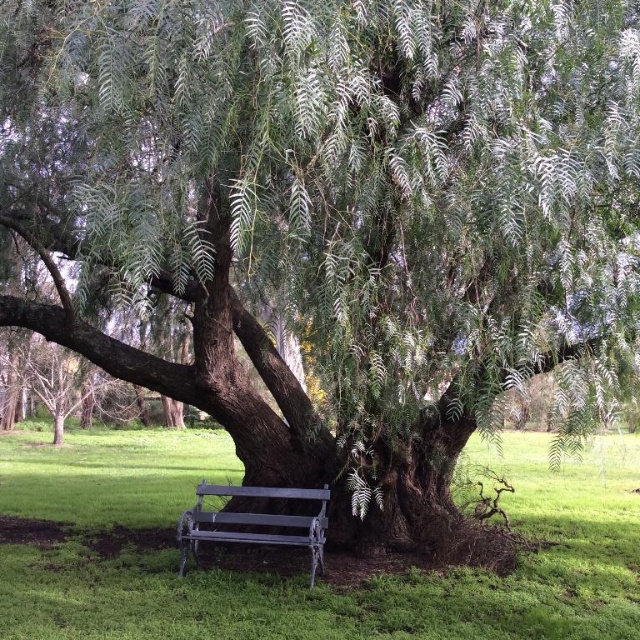
Who is more distant from viewer, (x=627, y=513) or (x=196, y=492)?

The point (x=627, y=513) is behind.

Is green grass at lower center above metallic gray bench at lower center?

Actually, green grass at lower center is below metallic gray bench at lower center.

Who is more distant from viewer, [161,554] or [294,525]?

The point [161,554] is behind.

The width and height of the screenshot is (640, 640). In order to click on green grass at lower center in this screenshot , I will do `click(301, 556)`.